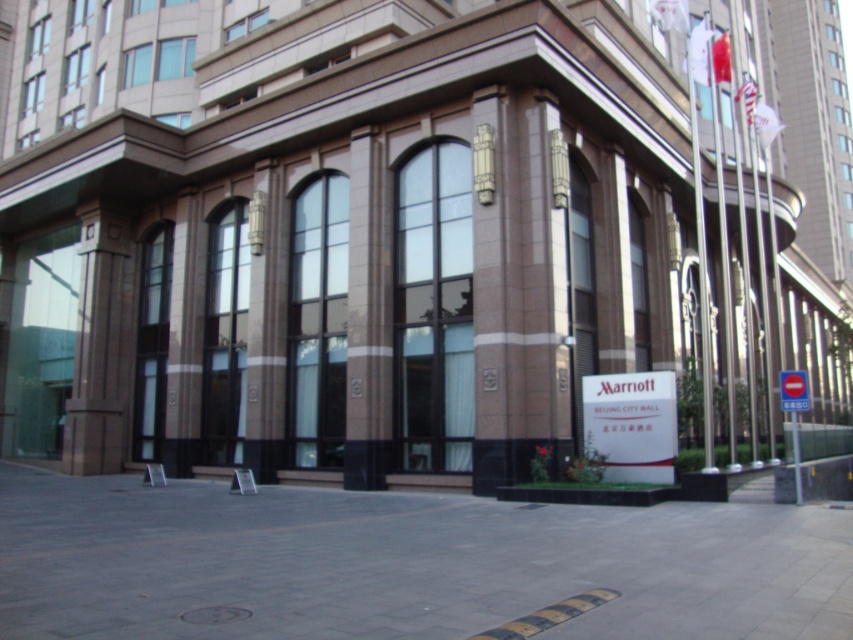
You are a delivery person trying to determine which sign to follow for the Marriott Beijing City Wall hotel. Both the white paper sign at lower right and the white plastic sign at center right are present. Which sign is narrower?

The white paper sign at lower right is thinner than the white plastic sign at center right, so the white paper sign at lower right is narrower.

You are standing at the entrance of the Marriott Beijing City Wall hotel and want to place a small potted plant exactly at the center of the gray concrete pavement at center. Given that the coordinates of the pavement are defined by the point at (402, 563), where should you place the plant?

The gray concrete pavement at center is located at the coordinates point (402, 563), so you should place the plant exactly at that point.

You are standing in front of the Marriott Beijing City Wall hotel. There is a point marked at coordinates [368,314]. What object is located at that point?

The point at coordinates [368,314] marks the brown stone column at center.